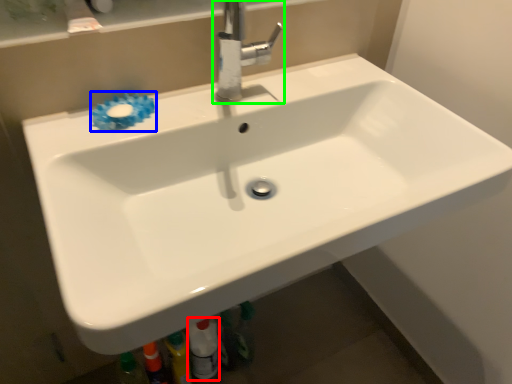
Question: Which is farther away from toiletry (highlighted by a red box)? flower (highlighted by a blue box) or tap (highlighted by a green box)?

Choices:
 (A) flower
 (B) tap

Answer: (B)